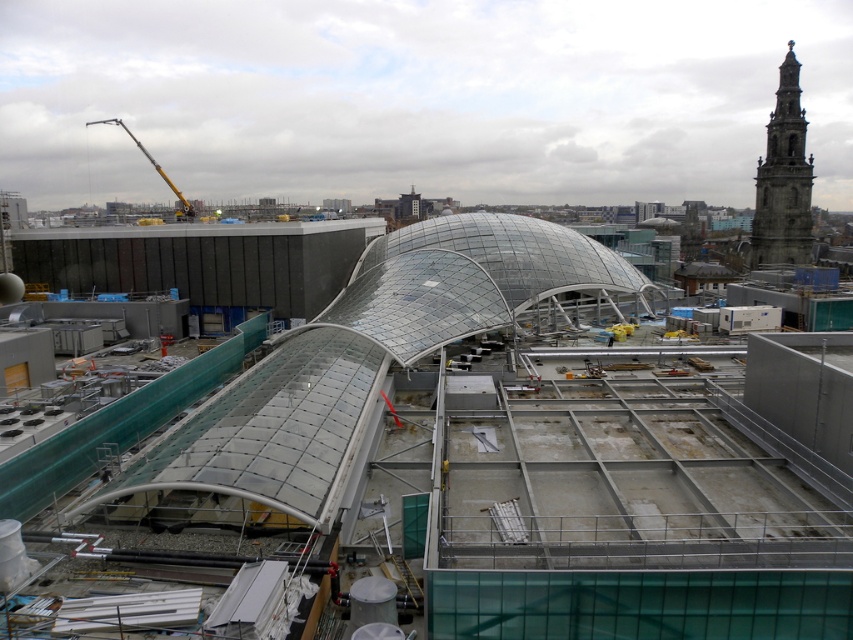
You are an architect observing the construction site. You need to determine the relative height of the transparent glass dome at center compared to the stone tower at upper right. Which one is taller?

The stone tower at upper right is taller than the transparent glass dome at center.

You are an architect evaluating the construction site. You need to determine if the transparent glass dome at center can be moved closer to the stone tower at upper right without overlapping. Based on their widths, can they be positioned side by side within the available space?

The transparent glass dome at center is wider than the stone tower at upper right. To position them side by side without overlapping, the total width required would be the sum of both their widths. Since the exact available space isn not provided, but knowing the dome is wider, ensure there is sufficient space accommodating both widths.